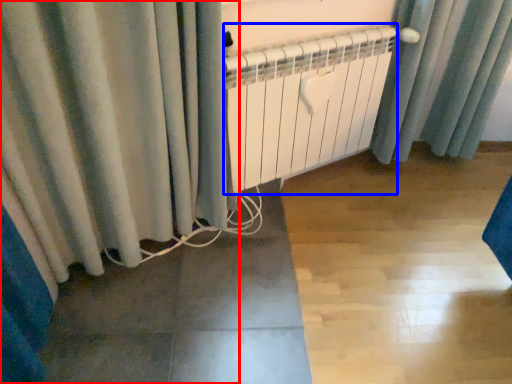
Question: Which object is further to the camera taking this photo, curtain (highlighted by a red box) or radiator (highlighted by a blue box)?

Choices:
 (A) curtain
 (B) radiator

Answer: (B)